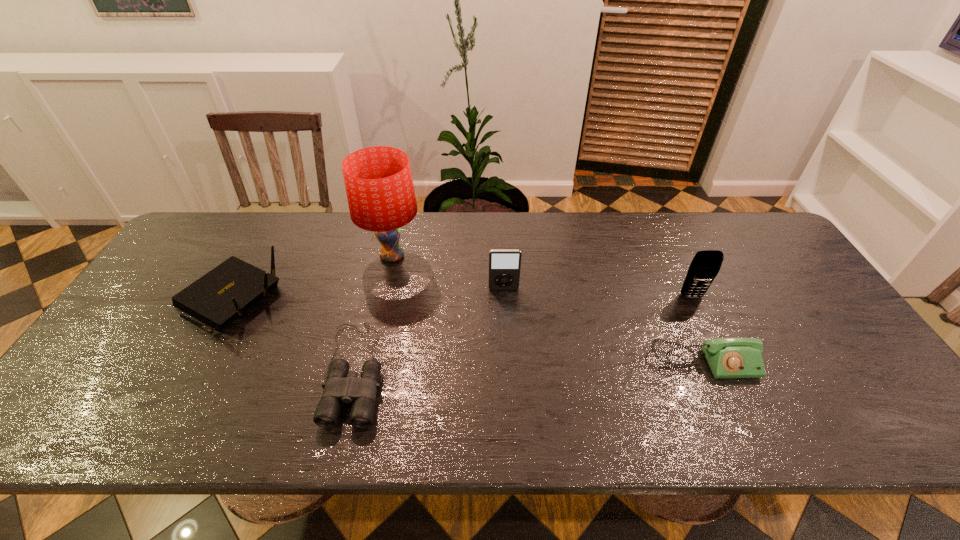
Locate an element on the screen. This screenshot has width=960, height=540. free space that is in between the lampshade and the cellular telephone is located at coordinates (541, 276).

The height and width of the screenshot is (540, 960). Find the location of `vacant space in between the router and the binoculars`. vacant space in between the router and the binoculars is located at coordinates (292, 336).

Identify the location of vacant area between the cellular telephone and the iPod. (597, 293).

Identify the location of unoccupied area between the third object from right to left and the lampshade. The width and height of the screenshot is (960, 540). (448, 272).

Where is `free spot between the third object from right to left and the fifth tallest object`? The width and height of the screenshot is (960, 540). free spot between the third object from right to left and the fifth tallest object is located at coordinates (604, 326).

Locate an element on the screen. The height and width of the screenshot is (540, 960). blank region between the cellular telephone and the telephone is located at coordinates (698, 329).

Locate an element on the screen. Image resolution: width=960 pixels, height=540 pixels. empty space that is in between the lampshade and the cellular telephone is located at coordinates (541, 276).

Find the location of a particular element. This screenshot has height=540, width=960. empty space between the second shortest object and the iPod is located at coordinates (604, 326).

What are the coordinates of `vacant area that lies between the fourth object from left to right and the lampshade` in the screenshot? It's located at (448, 272).

Point out which object is positioned as the second nearest to the third object from right to left. Please provide its 2D coordinates. Your answer should be formatted as a tuple, i.e. [(x, y)], where the tuple contains the x and y coordinates of a point satisfying the conditions above.

[(342, 386)]